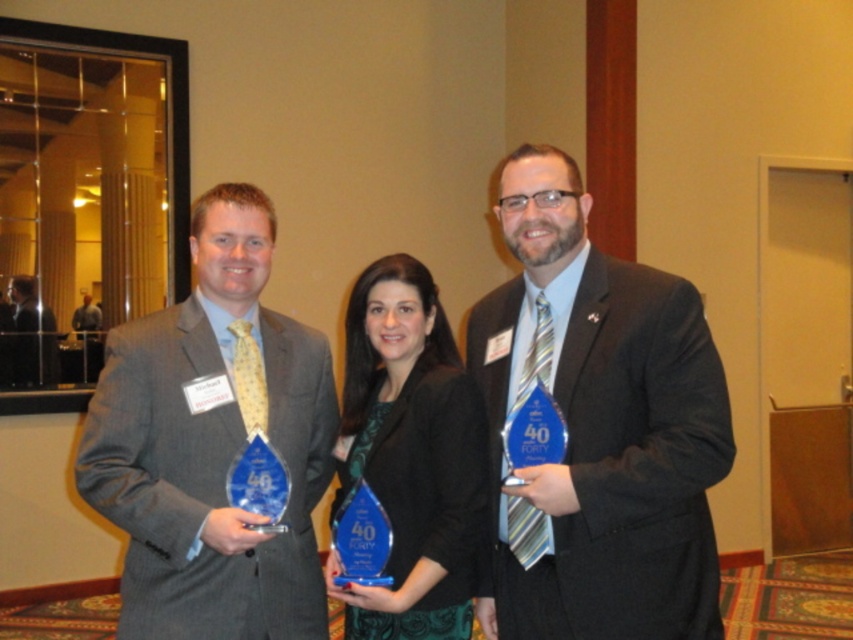
In the scene shown: You are a photographer at the event and need to capture a photo of the matte blue glass award at center and the matte black suit at left. Since the award is taller than the suit, how should you adjust your camera angle to ensure both are fully visible in the frame?

Since the matte blue glass award at center is taller than the matte black suit at left, you should tilt your camera slightly upward to capture the full height of the award while still including the suit in the frame.